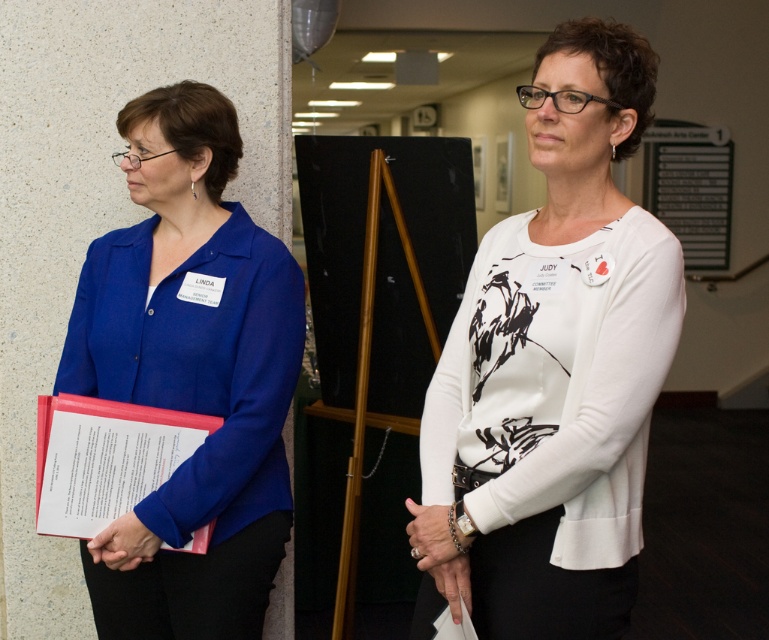
You are organizing a photo shoot and want to ensure proper lighting for both the white matte sweater at center and the blue matte blazer at left. Considering their heights, which object should be placed closer to the light source to ensure even illumination?

The white matte sweater at center has a lesser height compared to the blue matte blazer at left. To ensure even illumination, the shorter white matte sweater at center should be placed closer to the light source so that both receive similar lighting levels.

You are an event organizer trying to arrange seating for a panel discussion. You need to place a name tag on the table in front of each participant. The name tags should be placed so that they are not covered by any clothing items. Given the positions of the white matte sweater at center and the blue matte blazer at left, where should you position the name tags to ensure they are visible?

The white matte sweater at center is positioned over the blue matte blazer at left. Therefore, to ensure visibility, the name tag should be placed in an area not covered by the white matte sweater at center, which is over the blue matte blazer at left.